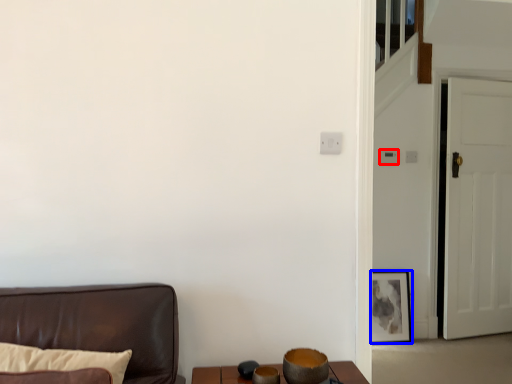
Question: Which point is further to the camera, light switch (highlighted by a red box) or picture frame (highlighted by a blue box)?

Choices:
 (A) light switch
 (B) picture frame

Answer: (A)